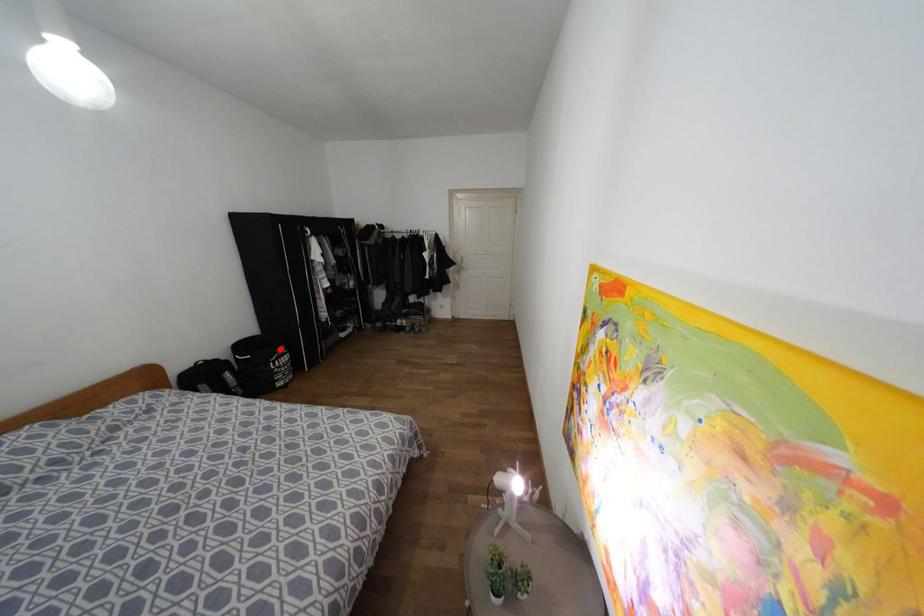
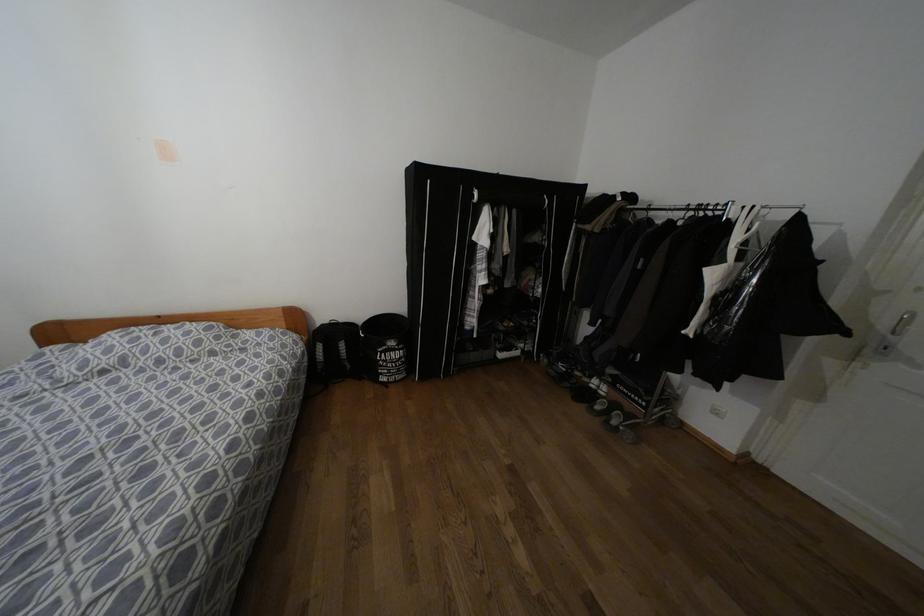
Question: I am providing you with two images of the same scene from different viewpoints. A red point is marked on the first image. Can you still see the location of the red point in image 2?

Choices:
 (A) Yes
 (B) No

Answer: (A)